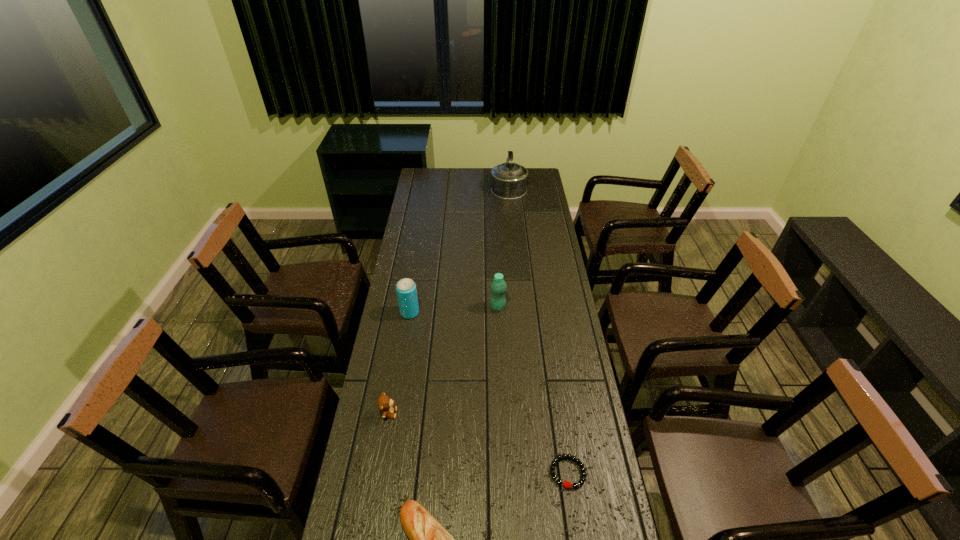
Locate an element on the screen. The image size is (960, 540). vacant space situated 0.070m at the front cap of the water bottle is located at coordinates (472, 307).

Identify the location of blank space located at the front cap of the water bottle. Image resolution: width=960 pixels, height=540 pixels. (397, 307).

I want to click on vacant space located on the right of the soda can, so click(x=488, y=313).

Identify the location of vacant space located 0.320m on the face of the third shortest object. (496, 413).

Image resolution: width=960 pixels, height=540 pixels. Find the location of `vacant space located on the left of the bracelet`. vacant space located on the left of the bracelet is located at coordinates (460, 472).

The width and height of the screenshot is (960, 540). Find the location of `object present at the far edge`. object present at the far edge is located at coordinates (x=508, y=180).

Locate an element on the screen. The width and height of the screenshot is (960, 540). soda can that is at the left edge is located at coordinates [406, 290].

This screenshot has height=540, width=960. Identify the location of teddy bear that is at the left edge. (385, 404).

Locate an element on the screen. The image size is (960, 540). kettle situated at the right edge is located at coordinates (508, 180).

The width and height of the screenshot is (960, 540). Find the location of `bracelet that is positioned at the right edge`. bracelet that is positioned at the right edge is located at coordinates tap(566, 484).